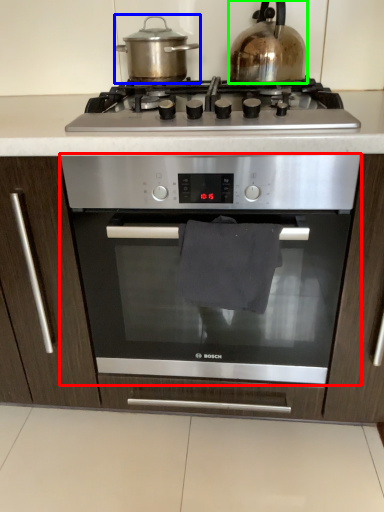
Question: Based on their relative distances, which object is farther from oven (highlighted by a red box)? Choose from kitchen appliance (highlighted by a blue box) and kitchen appliance (highlighted by a green box).

Choices:
 (A) kitchen appliance
 (B) kitchen appliance

Answer: (A)